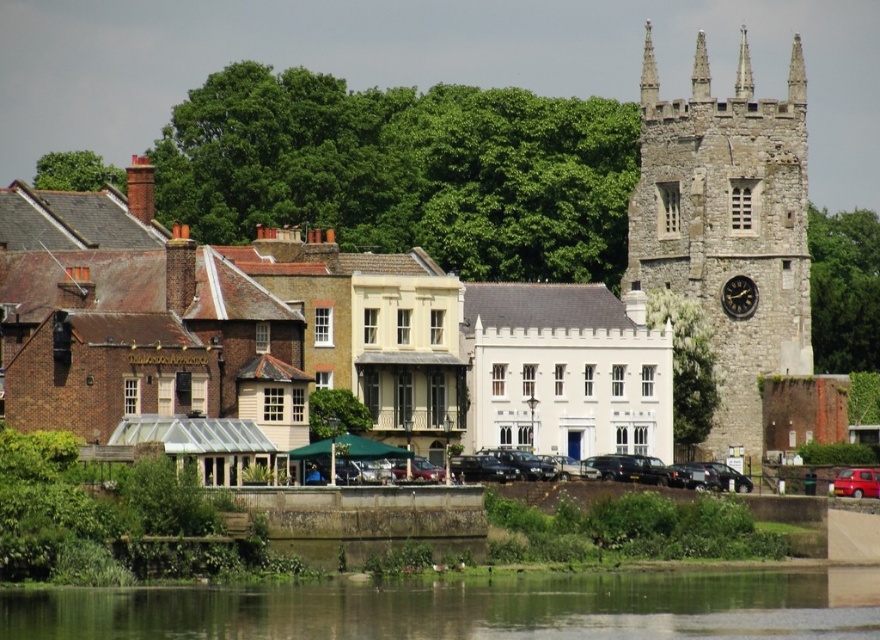
You are a tourist visiting the riverside area and want to take a photo that includes both the stone clock tower at right and the shiny red car at lower right. Which object should you position closer to the camera to ensure both are in the frame?

To include both the stone clock tower at right and the shiny red car at lower right in your photo, position the shiny red car at lower right closer to the camera since it is smaller than the stone clock tower at right, allowing both to fit within the frame.

You are a photographer planning to capture a wide shot of the stone clock tower at right and the shiny red car at lower right. Based on their sizes, which object should you position closer to the camera to ensure both fit in the frame?

The stone clock tower at right is wider than the shiny red car at lower right. To ensure both fit in the frame, position the shiny red car at lower right closer to the camera since it is narrower, allowing the wider stone clock tower at right to be captured without overcrowding the shot.

You are a tourist standing at the riverside and want to take a photo of the black metal clock at upper right. The camera you have can focus on objects up to 150 meters away. Will the clock be in focus?

The black metal clock at upper right is 134.15 meters away from camera, so yes, the clock will be in focus since it is within the camera focus range of 150 meters.